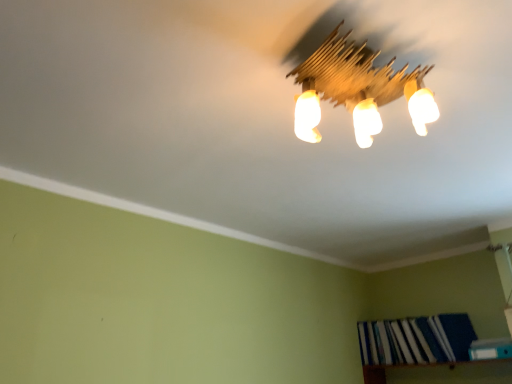
The height and width of the screenshot is (384, 512). Describe the element at coordinates (354, 88) in the screenshot. I see `wooden light fixture at upper center` at that location.

The width and height of the screenshot is (512, 384). Identify the location of wooden bookshelf at lower right. (441, 373).

Describe the element at coordinates (416, 340) in the screenshot. The image size is (512, 384). I see `blue hardcover book at lower right, which is counted as the 2th book, starting from the front` at that location.

The height and width of the screenshot is (384, 512). Identify the location of wooden light fixture at upper center. (354, 88).

Where is `book that is on the left side of blue fabric book at lower right, arranged as the 2th book when viewed from the back`? This screenshot has width=512, height=384. book that is on the left side of blue fabric book at lower right, arranged as the 2th book when viewed from the back is located at coordinates (416, 340).

Considering the relative sizes of blue hardcover book at lower right, which is counted as the 2th book, starting from the front, and blue fabric book at lower right, arranged as the first book when viewed from the front, in the image provided, is blue hardcover book at lower right, which is counted as the 2th book, starting from the front, bigger than blue fabric book at lower right, arranged as the first book when viewed from the front,?

Yes, blue hardcover book at lower right, which is counted as the 2th book, starting from the front, is bigger than blue fabric book at lower right, arranged as the first book when viewed from the front.

Which is more to the right, blue hardcover book at lower right, which is counted as the 2th book, starting from the front, or blue fabric book at lower right, arranged as the first book when viewed from the front?

From the viewer's perspective, blue fabric book at lower right, arranged as the first book when viewed from the front, appears more on the right side.

Which object is thinner, blue hardcover book at lower right, acting as the 1th book starting from the back, or blue fabric book at lower right, arranged as the 2th book when viewed from the back?

Thinner between the two is blue fabric book at lower right, arranged as the 2th book when viewed from the back.

Looking at their sizes, would you say blue hardcover book at lower right, acting as the 1th book starting from the back, is wider or thinner than wooden bookshelf at lower right?

Clearly, blue hardcover book at lower right, acting as the 1th book starting from the back, has less width compared to wooden bookshelf at lower right.

From a real-world perspective, who is located higher, blue hardcover book at lower right, which is counted as the 2th book, starting from the front, or wooden bookshelf at lower right?

In real-world perspective, blue hardcover book at lower right, which is counted as the 2th book, starting from the front, is above.

From the picture: Does blue hardcover book at lower right, acting as the 1th book starting from the back, have a greater height compared to wooden bookshelf at lower right?

Correct, blue hardcover book at lower right, acting as the 1th book starting from the back, is much taller as wooden bookshelf at lower right.

Is blue hardcover book at lower right, acting as the 1th book starting from the back, not near wooden bookshelf at lower right?

They are positioned close to each other.

Is wooden bookshelf at lower right at the back of wooden light fixture at upper center?

That's not correct — wooden light fixture at upper center is not looking away from wooden bookshelf at lower right.

You are a GUI agent. You are given a task and a screenshot of the screen. Output one action in this format:
    pyautogui.click(x=<x>, y=<y>)
    Task: Click on the lamp above the wooden bookshelf at lower right (from the image's perspective)
    Image resolution: width=512 pixels, height=384 pixels.
    Given the screenshot: What is the action you would take?
    pyautogui.click(x=354, y=88)

In terms of size, does wooden light fixture at upper center appear bigger or smaller than wooden bookshelf at lower right?

Clearly, wooden light fixture at upper center is smaller in size than wooden bookshelf at lower right.

Is wooden light fixture at upper center not near wooden bookshelf at lower right?

Yes, wooden light fixture at upper center and wooden bookshelf at lower right are located far from each other.

There is a wooden bookshelf at lower right. At what (x,y) coordinates should I click in order to perform the action: click on the 1st book above it (from a real-world perspective). Please return your answer as a coordinate pair (x, y). Looking at the image, I should click on (490, 349).

Is wooden bookshelf at lower right taller than blue fabric book at lower right, arranged as the first book when viewed from the front?

Indeed, wooden bookshelf at lower right has a greater height compared to blue fabric book at lower right, arranged as the first book when viewed from the front.

Considering the positions of points (435, 382) and (490, 340), is point (435, 382) closer to camera compared to point (490, 340)?

No, it is not.

Based on their sizes in the image, would you say wooden bookshelf at lower right is bigger or smaller than blue fabric book at lower right, arranged as the 2th book when viewed from the back?

In the image, wooden bookshelf at lower right appears to be larger than blue fabric book at lower right, arranged as the 2th book when viewed from the back.

From a real-world perspective, is blue fabric book at lower right, arranged as the first book when viewed from the front, physically below wooden bookshelf at lower right?

No.

Is blue fabric book at lower right, arranged as the first book when viewed from the front, bigger or smaller than wooden bookshelf at lower right?

Clearly, blue fabric book at lower right, arranged as the first book when viewed from the front, is smaller in size than wooden bookshelf at lower right.

Is wooden bookshelf at lower right not near blue hardcover book at lower right, which is counted as the 2th book, starting from the front?

No, wooden bookshelf at lower right is not far from blue hardcover book at lower right, which is counted as the 2th book, starting from the front.

What's the angular difference between wooden bookshelf at lower right and blue hardcover book at lower right, acting as the 1th book starting from the back,'s facing directions?

wooden bookshelf at lower right and blue hardcover book at lower right, acting as the 1th book starting from the back, are facing 2.43 degrees away from each other.

Is wooden bookshelf at lower right turned away from blue hardcover book at lower right, which is counted as the 2th book, starting from the front?

No, wooden bookshelf at lower right is not facing away from blue hardcover book at lower right, which is counted as the 2th book, starting from the front.

From the image's perspective, relative to blue hardcover book at lower right, which is counted as the 2th book, starting from the front, is blue fabric book at lower right, arranged as the first book when viewed from the front, above or below?

Clearly, from the image's perspective, blue fabric book at lower right, arranged as the first book when viewed from the front, is above blue hardcover book at lower right, which is counted as the 2th book, starting from the front.

Locate an element on the screen. This screenshot has height=384, width=512. book that appears on the right of blue hardcover book at lower right, which is counted as the 2th book, starting from the front is located at coordinates (490, 349).

Measure the distance between blue fabric book at lower right, arranged as the 2th book when viewed from the back, and blue hardcover book at lower right, acting as the 1th book starting from the back.

They are 13.74 inches apart.

Is blue fabric book at lower right, arranged as the first book when viewed from the front, wider than blue hardcover book at lower right, which is counted as the 2th book, starting from the front?

In fact, blue fabric book at lower right, arranged as the first book when viewed from the front, might be narrower than blue hardcover book at lower right, which is counted as the 2th book, starting from the front.

Locate an element on the screen. This screenshot has width=512, height=384. book below the blue fabric book at lower right, arranged as the first book when viewed from the front (from the image's perspective) is located at coordinates (416, 340).

Locate an element on the screen. the 2nd book behind the wooden bookshelf at lower right, starting your count from the anchor is located at coordinates (416, 340).

Estimate the real-world distances between objects in this image. Which object is closer to wooden bookshelf at lower right, wooden light fixture at upper center or blue hardcover book at lower right, which is counted as the 2th book, starting from the front?

Based on the image, blue hardcover book at lower right, which is counted as the 2th book, starting from the front, appears to be nearer to wooden bookshelf at lower right.

Considering their positions, is wooden bookshelf at lower right positioned closer to wooden light fixture at upper center than blue fabric book at lower right, arranged as the 2th book when viewed from the back?

Based on the image, blue fabric book at lower right, arranged as the 2th book when viewed from the back, appears to be nearer to wooden light fixture at upper center.

Based on the photo, considering their positions, is blue fabric book at lower right, arranged as the 2th book when viewed from the back, positioned closer to blue hardcover book at lower right, which is counted as the 2th book, starting from the front, than wooden bookshelf at lower right?

Among the two, wooden bookshelf at lower right is located nearer to blue hardcover book at lower right, which is counted as the 2th book, starting from the front.

Estimate the real-world distances between objects in this image. Which object is closer to wooden bookshelf at lower right, blue fabric book at lower right, arranged as the 2th book when viewed from the back, or blue hardcover book at lower right, acting as the 1th book starting from the back?

Among the two, blue hardcover book at lower right, acting as the 1th book starting from the back, is located nearer to wooden bookshelf at lower right.

Which object lies nearer to the anchor point blue hardcover book at lower right, which is counted as the 2th book, starting from the front, wooden light fixture at upper center or wooden bookshelf at lower right?

wooden bookshelf at lower right is closer to blue hardcover book at lower right, which is counted as the 2th book, starting from the front.

Looking at this image, based on their spatial positions, is wooden bookshelf at lower right or blue fabric book at lower right, arranged as the 2th book when viewed from the back, closer to blue hardcover book at lower right, acting as the 1th book starting from the back?

Among the two, wooden bookshelf at lower right is located nearer to blue hardcover book at lower right, acting as the 1th book starting from the back.

Considering their positions, is wooden light fixture at upper center positioned closer to blue fabric book at lower right, arranged as the first book when viewed from the front, than blue hardcover book at lower right, acting as the 1th book starting from the back?

blue hardcover book at lower right, acting as the 1th book starting from the back, is positioned closer to the anchor blue fabric book at lower right, arranged as the first book when viewed from the front.

Based on their spatial positions, is wooden bookshelf at lower right or blue hardcover book at lower right, which is counted as the 2th book, starting from the front, further from wooden light fixture at upper center?

Based on the image, wooden bookshelf at lower right appears to be further to wooden light fixture at upper center.

Identify the location of shelf between wooden light fixture at upper center and blue fabric book at lower right, arranged as the 2th book when viewed from the back, along the z-axis. (441, 373).

Identify the location of shelf located between blue hardcover book at lower right, which is counted as the 2th book, starting from the front, and blue fabric book at lower right, arranged as the first book when viewed from the front, in the left-right direction. 441,373.

Locate an element on the screen. The image size is (512, 384). book between wooden light fixture at upper center and blue hardcover book at lower right, which is counted as the 2th book, starting from the front, along the z-axis is located at coordinates (490, 349).

Identify the location of shelf located between wooden light fixture at upper center and blue hardcover book at lower right, acting as the 1th book starting from the back, in the depth direction. The image size is (512, 384). (441, 373).